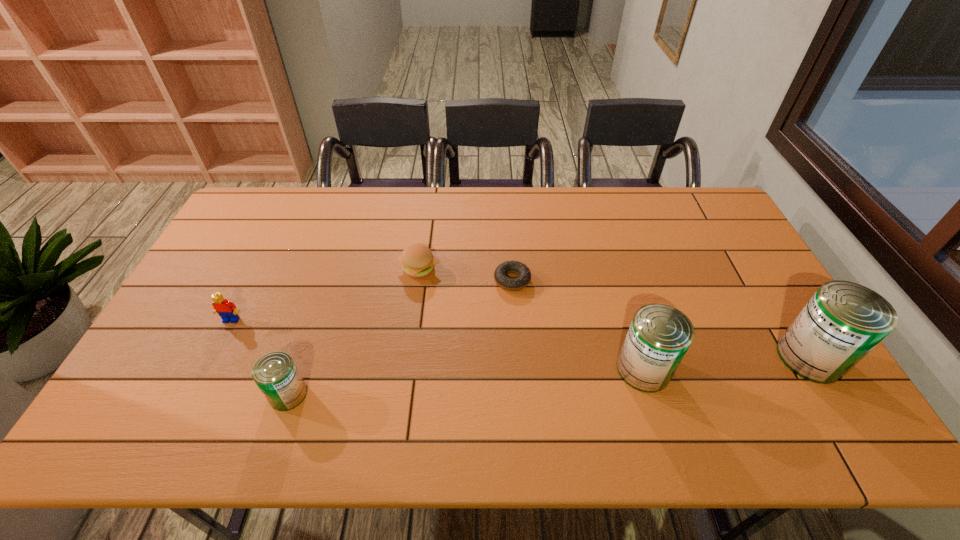
Identify the location of vacant space that satisfies the following two spatial constraints: 1. on the front side of the hamburger; 2. on the right side of the second can from left to right. (405, 369).

The image size is (960, 540). I want to click on free region that satisfies the following two spatial constraints: 1. on the front-facing side of the rightmost can; 2. on the right side of the leftmost object, so click(x=213, y=357).

This screenshot has height=540, width=960. In order to click on free space that satisfies the following two spatial constraints: 1. on the front-facing side of the shortest can; 2. on the left side of the Lego in this screenshot , I will do `click(195, 394)`.